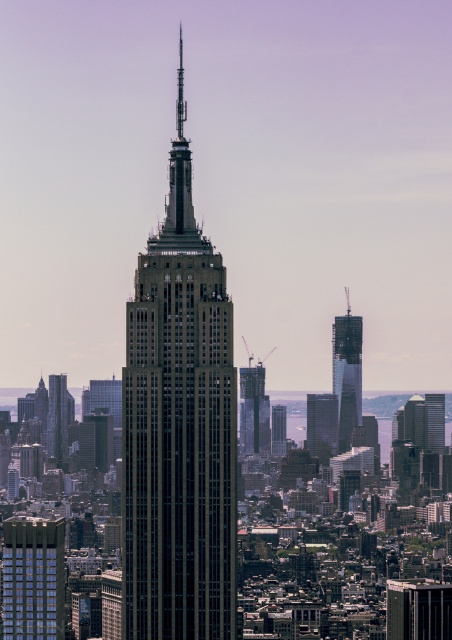
You are a city planner assessing the distance between two skyscrapers in the image. The metallic glass skyscraper at center and the glassy steel skyscraper at center are both central landmarks. Can a helicopter with a rotor diameter of 150 feet safely land between them without touching either building?

The metallic glass skyscraper at center and the glassy steel skyscraper at center are 196.51 feet apart. Since the helicopter has a rotor diameter of 150 feet, there is sufficient space between them for safe landing as the distance between the buildings is greater than the rotor diameter.

You are a drone operator trying to navigate a drone through the city. You need to fly your drone from the starting point at coordinates 0.953, 0.925 to the Empire State Building. Which direction should you fly the metallic glass skyscraper at center to reach the Empire State Building?

The metallic glass skyscraper at center is already at the Empire State Building, so no direction change is needed.

You are standing in the city park and looking at the two skyscrapers in front of you. Which one is closer to you, the glassy reflective skyscraper at center or the dark gray glass skyscraper at center?

The glassy reflective skyscraper at center is closer because it is in front of the dark gray glass skyscraper at center.